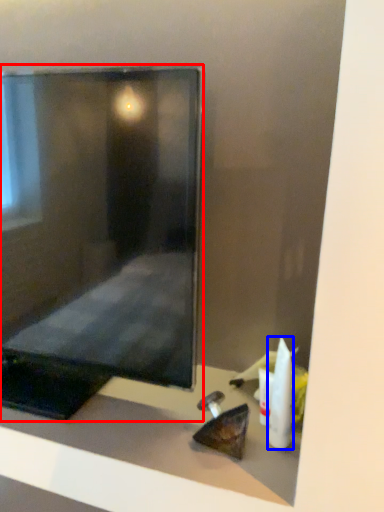
Question: Which object appears farthest to the camera in this image, computer monitor (highlighted by a red box) or toiletry (highlighted by a blue box)?

Choices:
 (A) computer monitor
 (B) toiletry

Answer: (B)